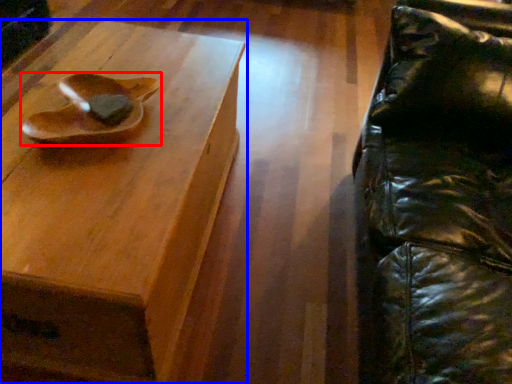
Question: Which object is further to the camera taking this photo, footwear (highlighted by a red box) or table (highlighted by a blue box)?

Choices:
 (A) footwear
 (B) table

Answer: (A)